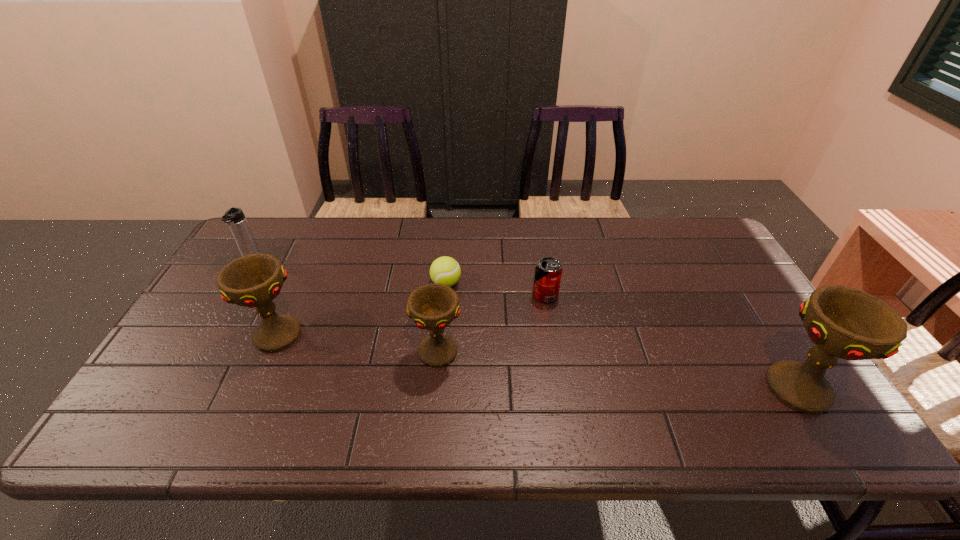
Locate an element on the screen. The height and width of the screenshot is (540, 960). the second object from left to right is located at coordinates (254, 280).

This screenshot has height=540, width=960. Identify the location of the leftmost chalice. (254, 280).

I want to click on the second chalice from left to right, so (x=433, y=307).

Identify the location of the rightmost chalice. (843, 322).

The image size is (960, 540). I want to click on tennis ball, so click(x=445, y=270).

I want to click on the second object from right to left, so click(548, 272).

This screenshot has height=540, width=960. Identify the location of soda can. (548, 272).

The height and width of the screenshot is (540, 960). What are the coordinates of `the farthest object` in the screenshot? It's located at (234, 217).

The width and height of the screenshot is (960, 540). What are the coordinates of `thermos bottle` in the screenshot? It's located at (234, 217).

Locate an element on the screen. Image resolution: width=960 pixels, height=540 pixels. free space located on the right of the second shortest chalice is located at coordinates (428, 335).